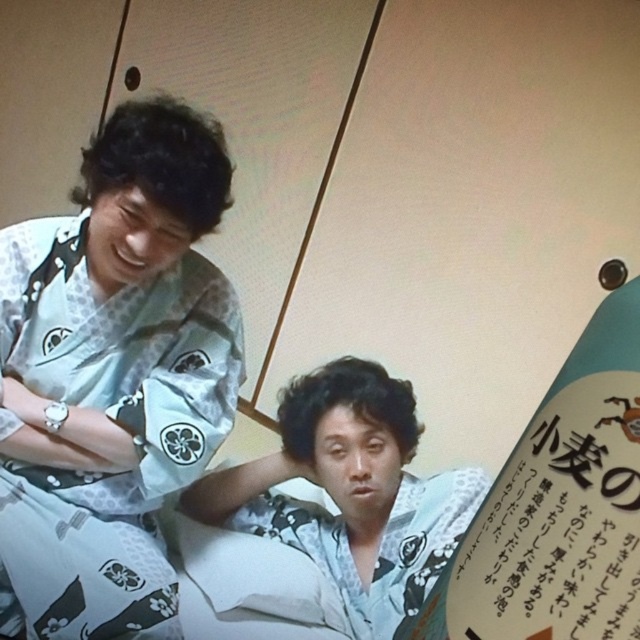
Does white floral kimono at left come behind white floral kimono at center?

No.

In the scene shown: Is white floral kimono at left thinner than white floral kimono at center?

Yes, white floral kimono at left is thinner than white floral kimono at center.

The image size is (640, 640). Find the location of `white floral kimono at left`. white floral kimono at left is located at coordinates (113, 378).